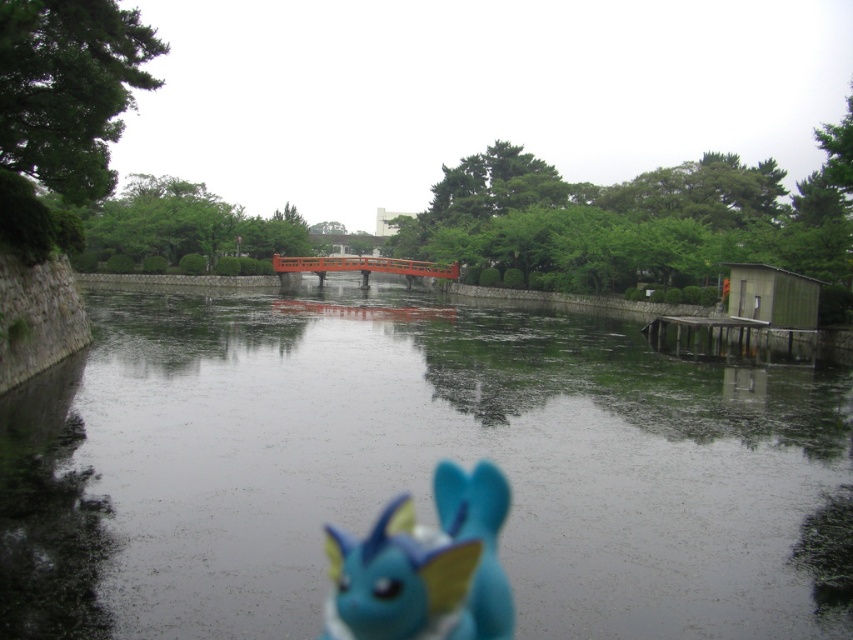
You are a photographer trying to capture the reflection of the glossy concrete river at center in your shot. Since the blue matte toy at center is in the way, can you adjust your position to still get the reflection without the toy appearing in the frame?

The glossy concrete river at center is taller than the blue matte toy at center, so adjusting your position slightly lower might allow you to capture the reflection of the glossy concrete river at center while keeping the blue matte toy at center out of the frame.

You are standing on the stone wall on the left side of the image. You see a point marked at coordinates (415,468). Based on the scene description, where is this point located?

The point at coordinates (415,468) is located on the glossy concrete river at center.